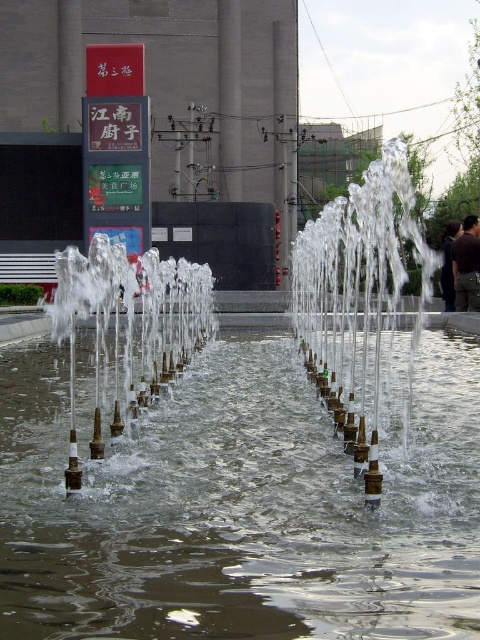
You are standing in front of the fountain and want to take a photo of the clear water at center and the clear water jets at center. Which one will appear larger in your photo?

The clear water at center appears larger in the photo because it is closer to the viewer than the clear water jets at center.

You are a photographer trying to capture the tallest part of the water in the fountain. Which object between the clear water at center and the clear water jets at center should you focus on?

The clear water jets at center reach higher than the clear water at center, so focusing on the clear water jets at center will capture the tallest part of the water in the fountain.